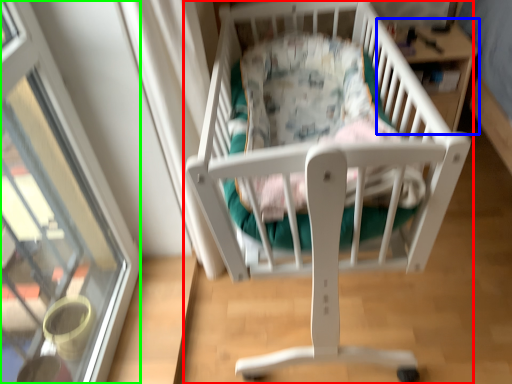
Question: Which object is positioned closest to infant bed (highlighted by a red box)? Select from table (highlighted by a blue box) and glass door (highlighted by a green box).

Choices:
 (A) table
 (B) glass door

Answer: (B)